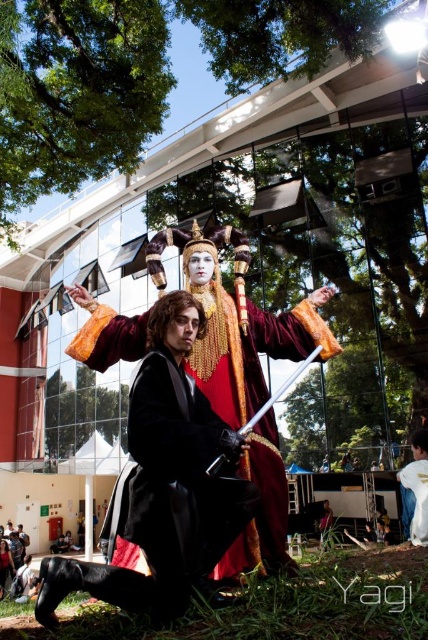
The image size is (428, 640). What do you see at coordinates (252, 349) in the screenshot?
I see `velvet maroon cape at center` at bounding box center [252, 349].

Who is positioned more to the left, velvet maroon cape at center or matte black dress at lower left?

From the viewer's perspective, matte black dress at lower left appears more on the left side.

Does point (235, 392) come behind point (6, 573)?

No, it is not.

Where is `velvet maroon cape at center`? This screenshot has width=428, height=640. velvet maroon cape at center is located at coordinates (252, 349).

Can you confirm if white matte shirt at lower right is positioned below matte black dress at lower left?

Incorrect, white matte shirt at lower right is not positioned below matte black dress at lower left.

Is point (415, 480) closer to camera compared to point (0, 552)?

That is True.

Between point (410, 522) and point (0, 552), which one is positioned in front?

Point (410, 522) is more forward.

Locate an element on the screen. This screenshot has width=428, height=640. white matte shirt at lower right is located at coordinates (416, 486).

Does point (228, 381) come closer to viewer compared to point (404, 484)?

That is True.

How far apart are velvet maroon cape at center and white matte shirt at lower right?

velvet maroon cape at center and white matte shirt at lower right are 28.77 feet apart.

Is point (275, 428) more distant than point (419, 493)?

No.

Image resolution: width=428 pixels, height=640 pixels. Find the location of `velvet maroon cape at center`. velvet maroon cape at center is located at coordinates (252, 349).